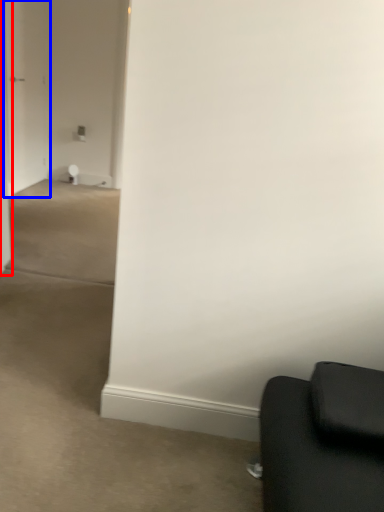
Question: Which object is further to the camera taking this photo, door (highlighted by a red box) or glass door (highlighted by a blue box)?

Choices:
 (A) door
 (B) glass door

Answer: (B)